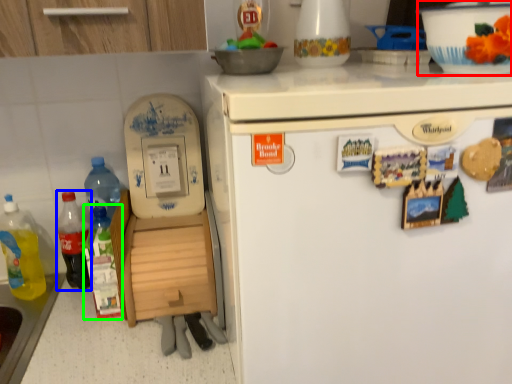
Question: Estimate the real-world distances between objects in this image. Which object is farther from bowl (highlighted by a red box), bottle (highlighted by a blue box) or bottle (highlighted by a green box)?

Choices:
 (A) bottle
 (B) bottle

Answer: (A)